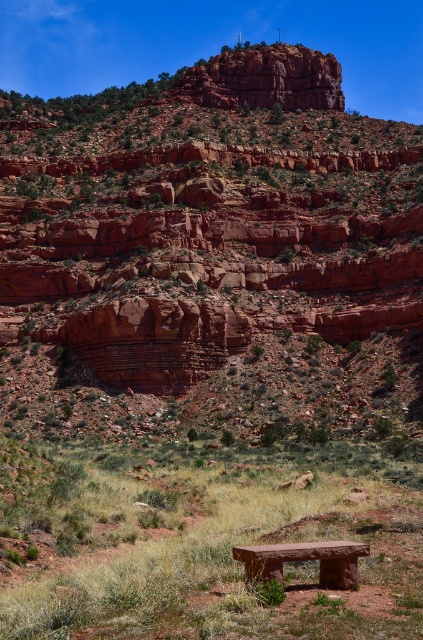
You are a hiker who wants to sit on the bench closest to the ground. Which bench should you choose between the brown stone bench at center and the smooth stone bench at center?

The brown stone bench at center is below the smooth stone bench at center, so you should choose the brown stone bench at center as it is closer to the ground.

You are standing at the edge of the rugged red rock formation and see the brown stone bench at center and the smooth stone bench at center. Which bench is positioned more to the left?

The brown stone bench at center is positioned more to the left than the smooth stone bench at center.